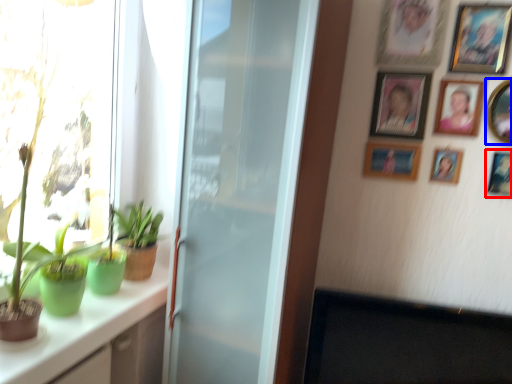
Question: Which object appears closest to the camera in this image, picture frame (highlighted by a red box) or picture frame (highlighted by a blue box)?

Choices:
 (A) picture frame
 (B) picture frame

Answer: (B)